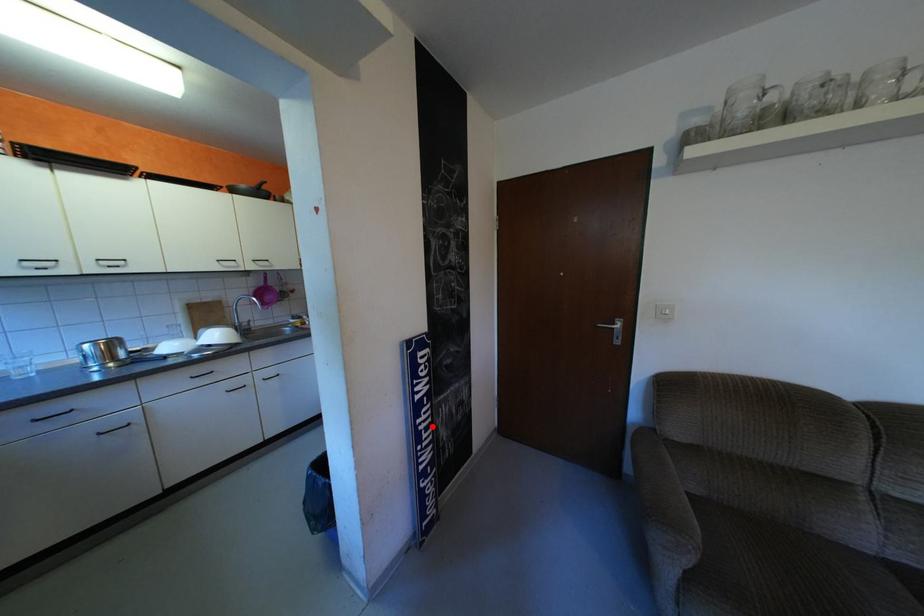
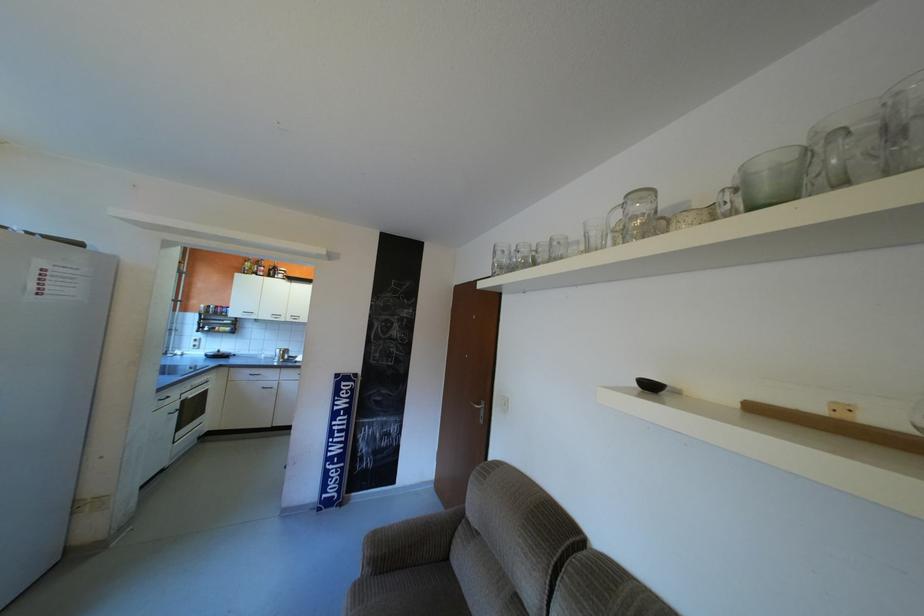
Question: I am providing you with two images of the same scene from different viewpoints. Given a red point in image1, look at the same physical point in image2. Is it:

Choices:
 (A) Closer to the viewpoint
 (B) Farther from the viewpoint

Answer: (B)